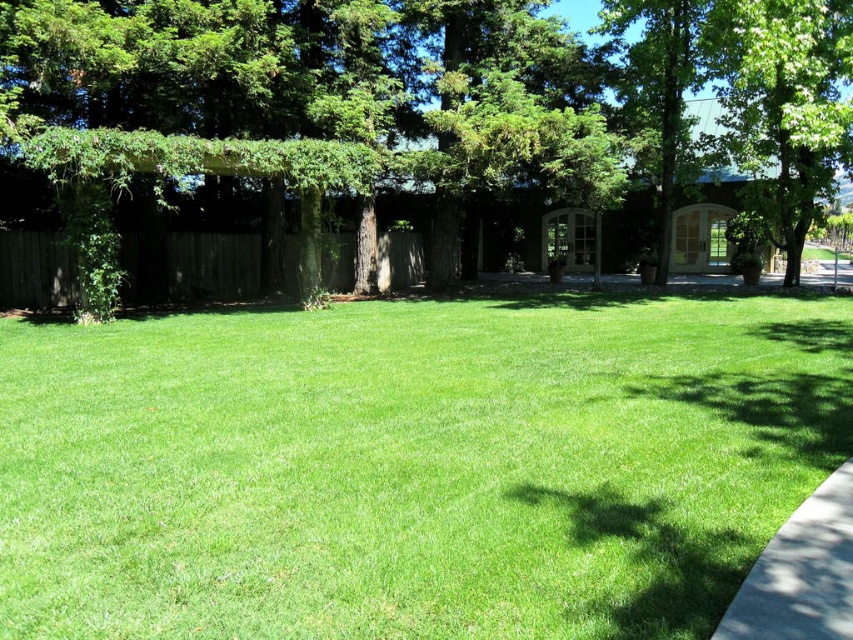
Is green grass at center shorter than gray concrete sidewalk at lower right?

No.

Does green grass at center have a larger size compared to gray concrete sidewalk at lower right?

Indeed, green grass at center has a larger size compared to gray concrete sidewalk at lower right.

Is point (334, 579) closer to camera compared to point (824, 600)?

No.

Identify the location of green grass at center. (410, 465).

Based on the photo, is green leafy tree at center to the left of green leafy tree at upper right from the viewer's perspective?

Yes, green leafy tree at center is to the left of green leafy tree at upper right.

What do you see at coordinates (154, 60) in the screenshot? Image resolution: width=853 pixels, height=640 pixels. I see `green leafy tree at center` at bounding box center [154, 60].

You are a GUI agent. You are given a task and a screenshot of the screen. Output one action in this format:
    pyautogui.click(x=<x>, y=<y>)
    Task: Click on the green leafy tree at center
    The image size is (853, 640).
    Given the screenshot: What is the action you would take?
    pyautogui.click(x=154, y=60)

At what (x,y) coordinates should I click in order to perform the action: click on green leafy tree at center. Please return your answer as a coordinate pair (x, y). The height and width of the screenshot is (640, 853). Looking at the image, I should click on (154, 60).

Is point (408, 444) closer to camera compared to point (753, 22)?

Yes, point (408, 444) is in front of point (753, 22).

From the picture: Between green grass at center and green leafy tree at upper right, which one has less height?

green grass at center

Is point (402, 448) more distant than point (759, 116)?

That is False.

Identify the location of green grass at center. (410, 465).